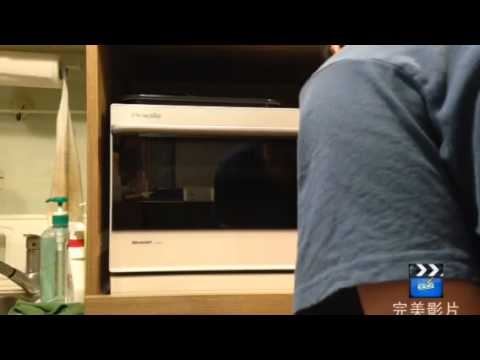
Image resolution: width=480 pixels, height=360 pixels. What are the coordinates of `words on microwave` in the screenshot? It's located at (140, 242), (148, 112).